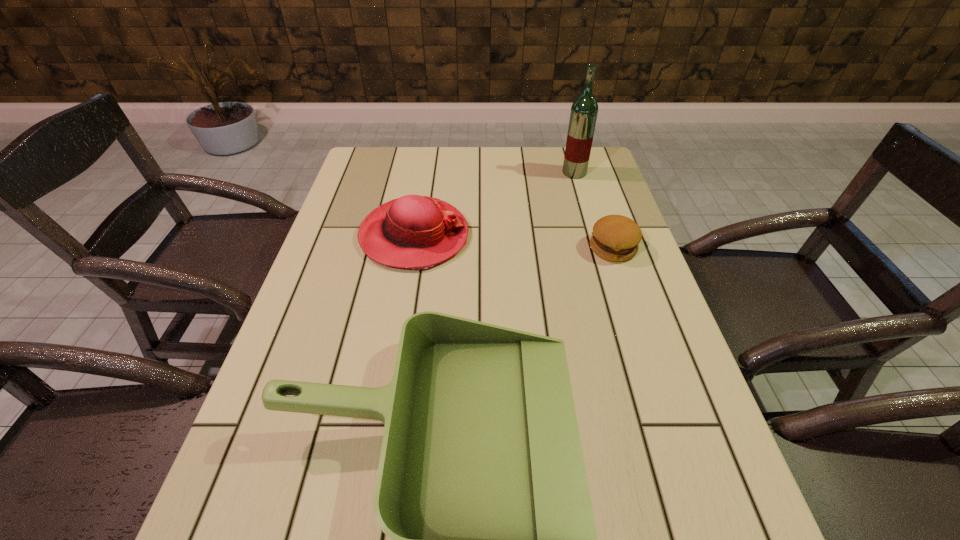
The width and height of the screenshot is (960, 540). Identify the location of object identified as the second closest to the hat. (615, 238).

You are a GUI agent. You are given a task and a screenshot of the screen. Output one action in this format:
    pyautogui.click(x=<x>, y=<y>)
    Task: Click on the free space that satisfies the following two spatial constraints: 1. on the front side of the liquor; 2. at the front of the hat with a bow
    The image size is (960, 540).
    Given the screenshot: What is the action you would take?
    pyautogui.click(x=592, y=236)